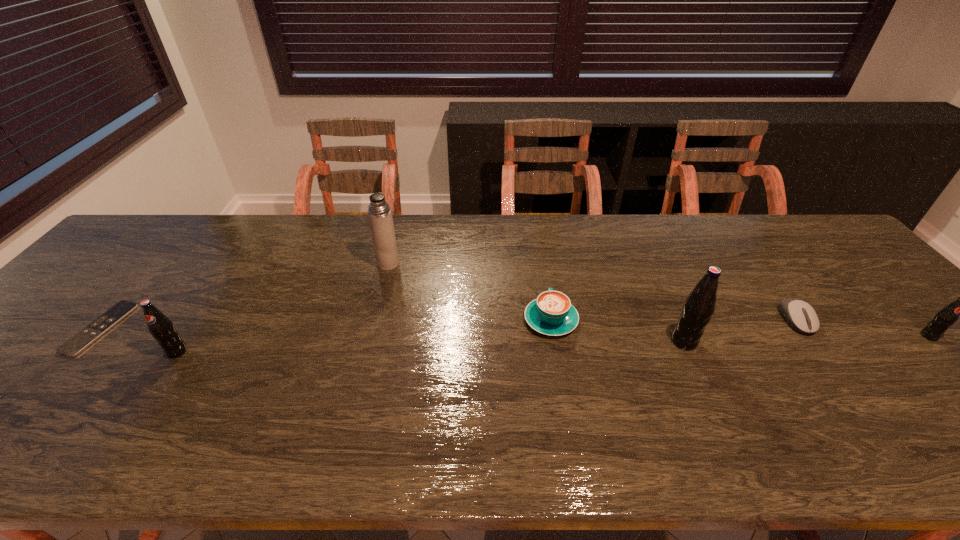
Locate an element on the screen. This screenshot has width=960, height=540. free space at the far right corner is located at coordinates (823, 235).

Locate an element on the screen. This screenshot has width=960, height=540. free space between the fourth tallest object and the farthest object is located at coordinates (659, 300).

Identify the location of unoccupied area between the second shortest object and the shortest pop. (862, 328).

You are a GUI agent. You are given a task and a screenshot of the screen. Output one action in this format:
    pyautogui.click(x=<x>, y=<y>)
    Task: Click on the free area in between the second object from right to left and the cappuccino
    The height and width of the screenshot is (540, 960).
    Given the screenshot: What is the action you would take?
    pyautogui.click(x=673, y=320)

The image size is (960, 540). I want to click on blank region between the rightmost object and the tallest pop, so click(806, 339).

The width and height of the screenshot is (960, 540). Find the location of `empty location between the cappuccino and the shortest object`. empty location between the cappuccino and the shortest object is located at coordinates (325, 324).

Where is `free space between the thermos bottle and the rightmost object`? free space between the thermos bottle and the rightmost object is located at coordinates (659, 300).

Find the location of a particular element. unoccupied area between the second tallest pop and the farthest object is located at coordinates (283, 308).

Identify the location of unoccupied area between the sixth tallest object and the farthest object. click(591, 292).

The image size is (960, 540). In order to click on vacant space that is in between the fourth object from left to right and the rightmost pop in this screenshot , I will do `click(740, 328)`.